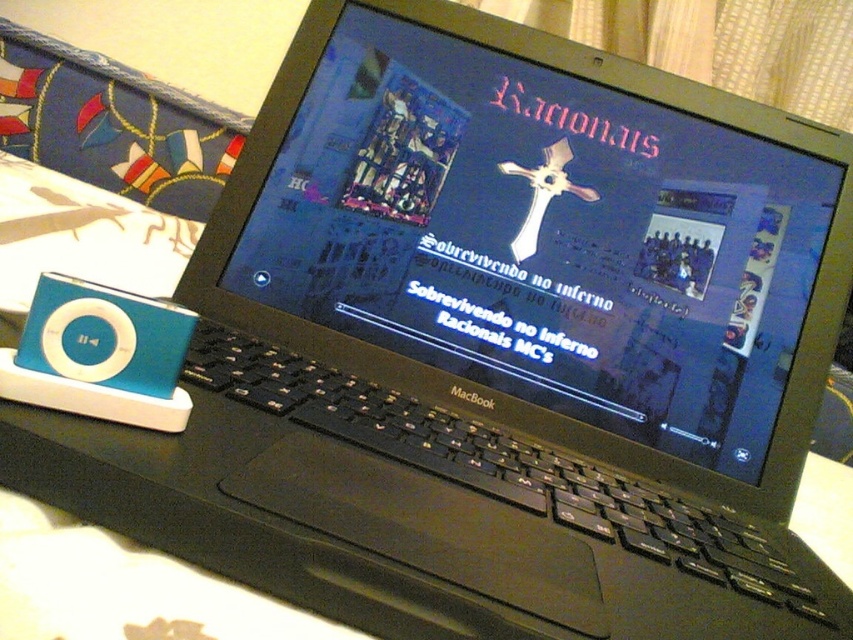
Measure the distance from black matte laptop at center to teal matte ipod at left.

11.82 inches

Is point (576, 321) farther from viewer compared to point (33, 300)?

Yes, it is.

What are the coordinates of `black matte laptop at center` in the screenshot? It's located at (544, 225).